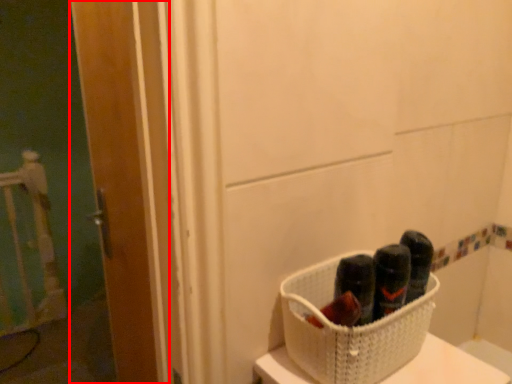
Question: From the image's perspective, what is the correct spatial positioning of door (annotated by the red box) in reference to basket?

Choices:
 (A) above
 (B) below

Answer: (A)